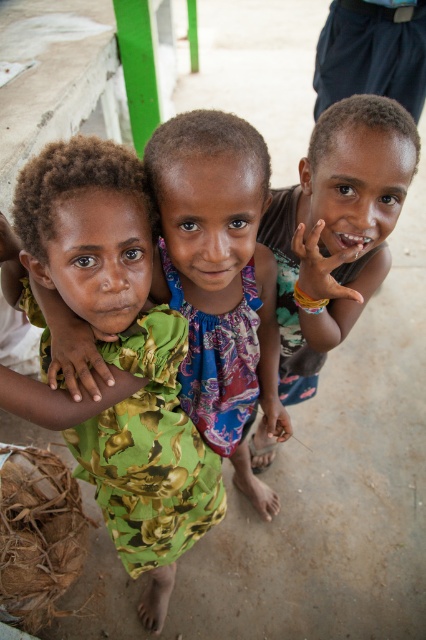
Question: Which point is closer to the camera?

Choices:
 (A) green floral dress at center
 (B) brown matte skin at center

Answer: (A)

Question: Considering the relative positions of green floral dress at center and brown matte skin at center in the image provided, where is green floral dress at center located with respect to brown matte skin at center?

Choices:
 (A) right
 (B) left

Answer: (B)

Question: Can you confirm if green floral dress at center is thinner than brown matte skin at center?

Choices:
 (A) yes
 (B) no

Answer: (B)

Question: Which of the following is the closest to the observer?

Choices:
 (A) (212, 524)
 (B) (353, 228)

Answer: (B)

Question: Can you confirm if green floral dress at center is wider than brown matte skin at center?

Choices:
 (A) yes
 (B) no

Answer: (A)

Question: Which object appears closest to the camera in this image?

Choices:
 (A) brown matte skin at center
 (B) green floral dress at center

Answer: (B)